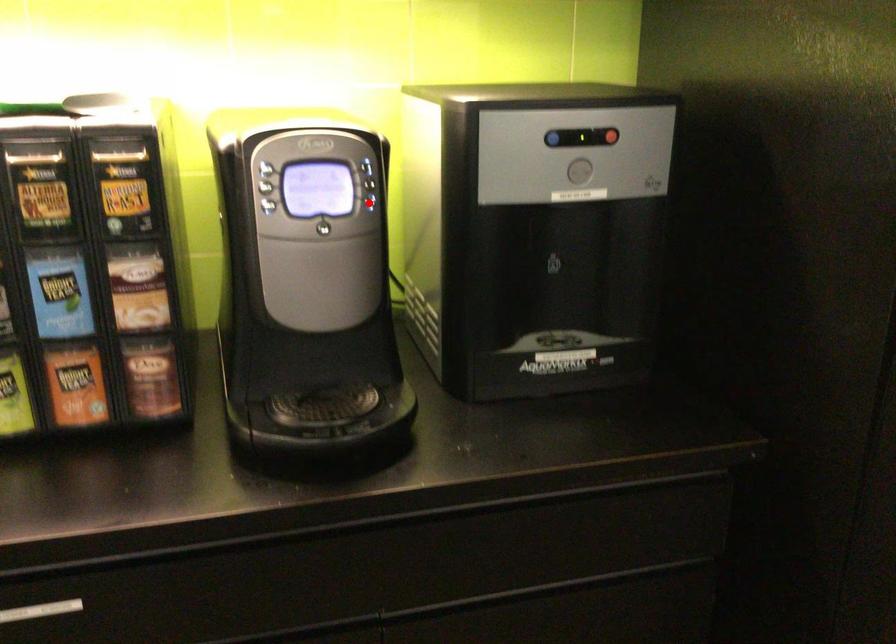
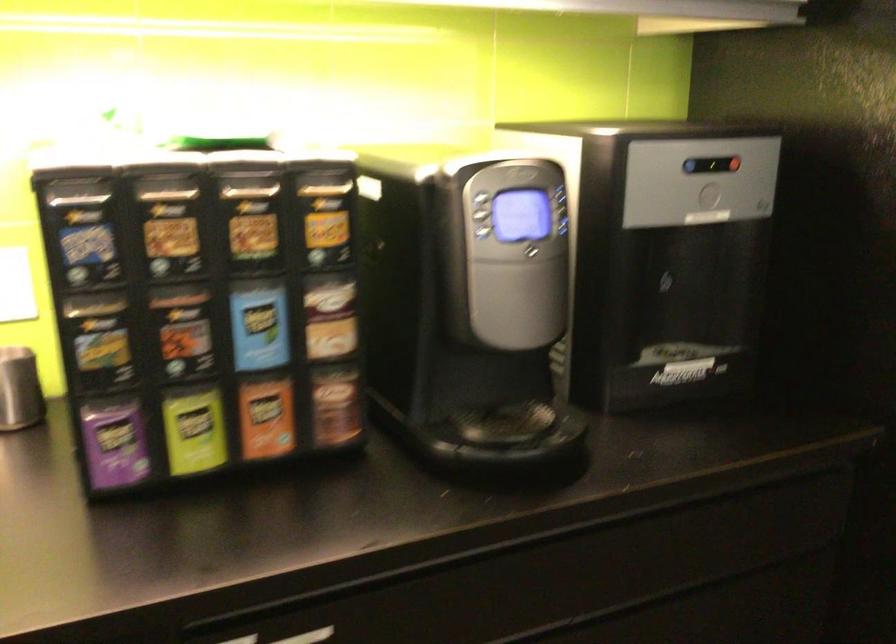
Find the pixel in the second image that matches the highlighted location in the first image.

(565, 227)